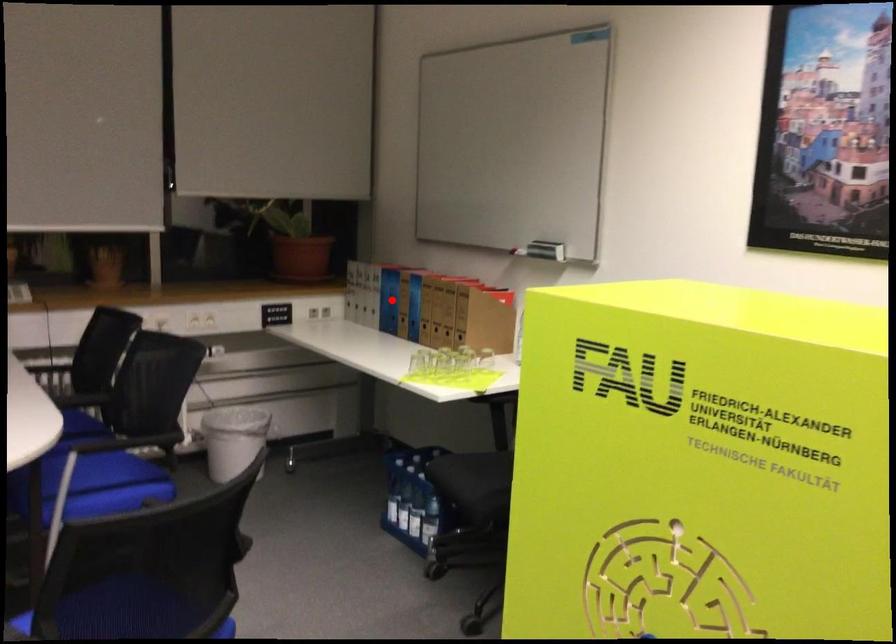
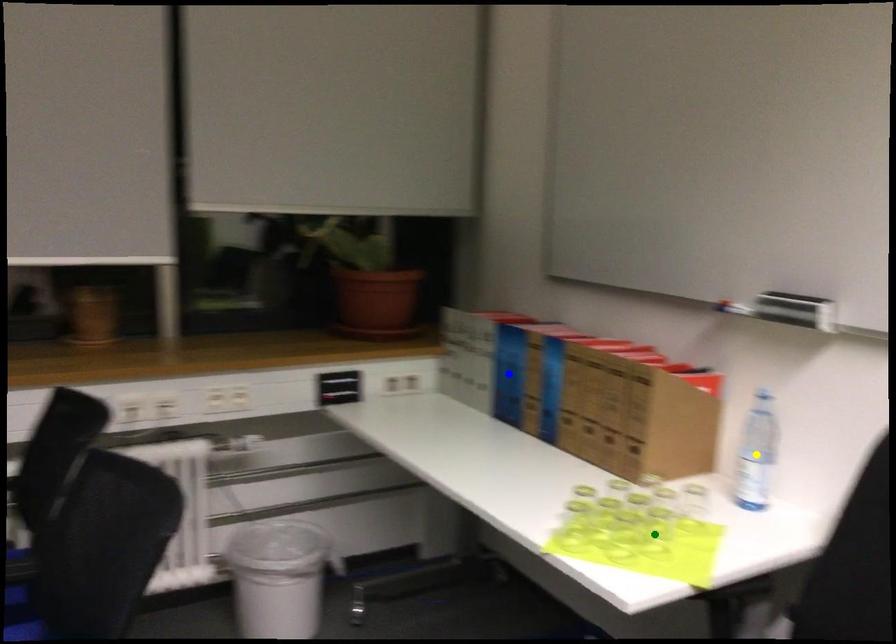
Question: I am providing you with two images of the same scene from different viewpoints. A red point is marked on the first image. You are given multiple points on the second image. Which mark in image 2 goes with the point in image 1?

Choices:
 (A) green point
 (B) yellow point
 (C) blue point

Answer: (C)